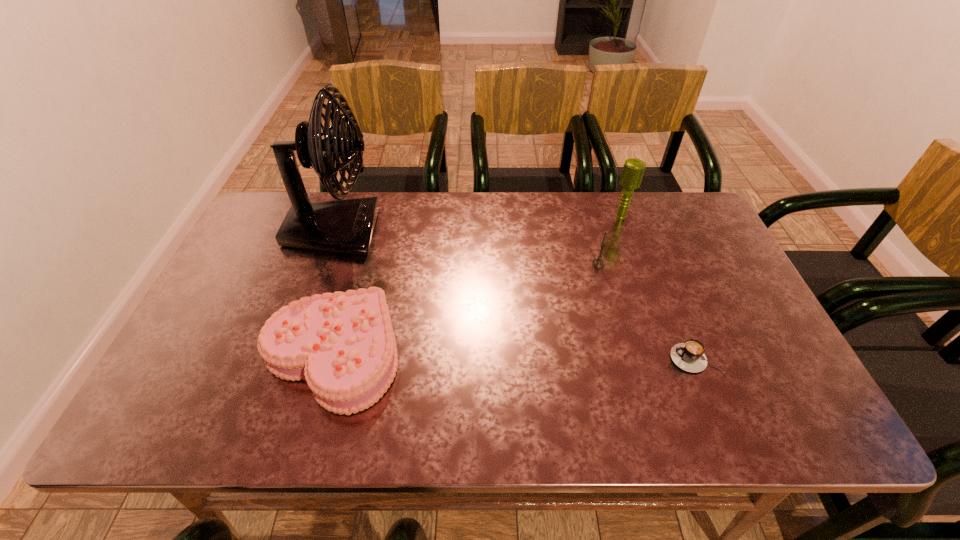
You are a GUI agent. You are given a task and a screenshot of the screen. Output one action in this format:
    pyautogui.click(x=<x>, y=<y>)
    Task: Click on the vacant area located with the handle on the side of the shortest object
    The image size is (960, 540).
    Given the screenshot: What is the action you would take?
    pyautogui.click(x=525, y=359)

This screenshot has height=540, width=960. I want to click on vacant region located 0.080m with the handle on the side of the shortest object, so [636, 359].

At what (x,y) coordinates should I click in order to perform the action: click on free location located with the handle on the side of the shortest object. Please return your answer as a coordinate pair (x, y). The image size is (960, 540). Looking at the image, I should click on (525, 359).

Where is `fan at the far edge`? fan at the far edge is located at coordinates (346, 226).

Locate an element on the screen. This screenshot has height=540, width=960. microphone that is positioned at the far edge is located at coordinates (633, 170).

The height and width of the screenshot is (540, 960). I want to click on object that is at the near edge, so click(343, 344).

At what (x,y) coordinates should I click in order to perform the action: click on object that is at the left edge. Please return your answer as a coordinate pair (x, y). This screenshot has height=540, width=960. Looking at the image, I should click on (346, 226).

I want to click on object present at the right edge, so click(x=689, y=356).

Find the location of `object located at the far left corner`. object located at the far left corner is located at coordinates (346, 226).

This screenshot has height=540, width=960. What are the coordinates of `free spot at the far edge of the desktop` in the screenshot? It's located at (538, 217).